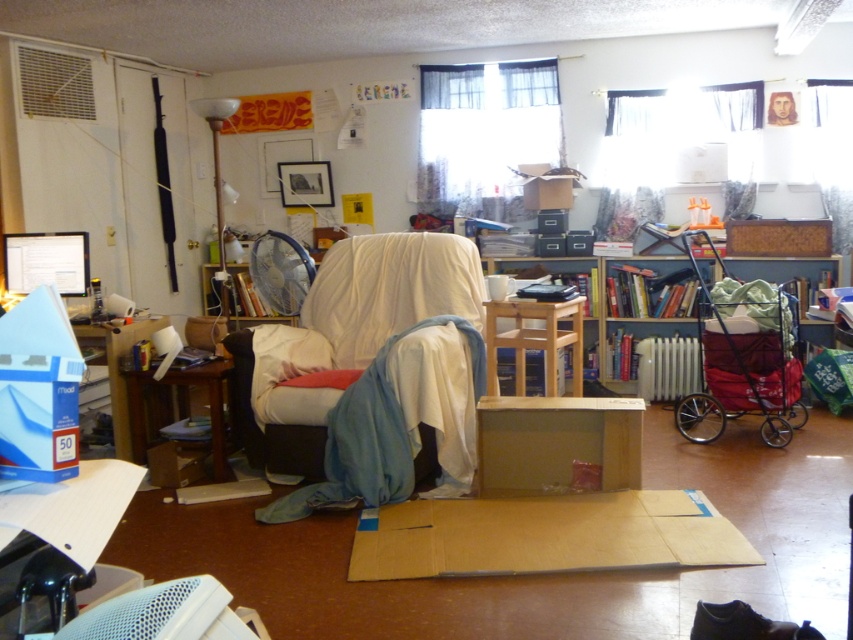
Which of these two, brown cardboard box at center or wooden bookshelf at center, stands shorter?

brown cardboard box at center is shorter.

This screenshot has height=640, width=853. In order to click on brown cardboard box at center in this screenshot , I will do `click(548, 502)`.

Is point (434, 513) farther from camera compared to point (799, 337)?

No.

You are a GUI agent. You are given a task and a screenshot of the screen. Output one action in this format:
    pyautogui.click(x=<x>, y=<y>)
    Task: Click on the brown cardboard box at center
    This screenshot has width=853, height=640.
    Given the screenshot: What is the action you would take?
    pyautogui.click(x=548, y=502)

Does white fabric chair at center have a larger size compared to wooden chair at center?

Correct, white fabric chair at center is larger in size than wooden chair at center.

Which is behind, point (402, 355) or point (492, 336)?

Positioned behind is point (492, 336).

The image size is (853, 640). What are the coordinates of `white fabric chair at center` in the screenshot? It's located at (358, 316).

Who is more forward, (x=579, y=548) or (x=143, y=417)?

Positioned in front is point (x=579, y=548).

Where is `brown cardboard box at center`? brown cardboard box at center is located at coordinates (548, 502).

Identify the location of brown cardboard box at center. (548, 502).